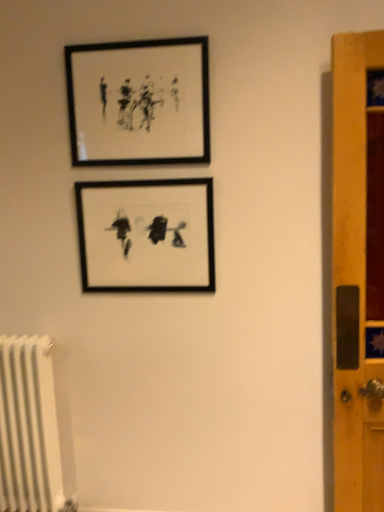
Question: Which is correct: black matte picture frame at upper center, positioned as the first picture frame in top-to-bottom order, is inside black matte picture frame at center, arranged as the 2th picture frame when viewed from the top, or outside of it?

Choices:
 (A) outside
 (B) inside

Answer: (A)

Question: Relative to black matte picture frame at center, arranged as the 2th picture frame when viewed from the top, is black matte picture frame at upper center, which is counted as the 2th picture frame, starting from the bottom, in front or behind?

Choices:
 (A) behind
 (B) front

Answer: (B)

Question: Is black matte picture frame at upper center, which is counted as the 2th picture frame, starting from the bottom, to the left or to the right of black matte picture frame at center, arranged as the 2th picture frame when viewed from the top, in the image?

Choices:
 (A) left
 (B) right

Answer: (A)

Question: Would you say black matte picture frame at center, arranged as the 2th picture frame when viewed from the top, is inside or outside black matte picture frame at upper center, positioned as the first picture frame in top-to-bottom order?

Choices:
 (A) outside
 (B) inside

Answer: (A)

Question: Is black matte picture frame at center, arranged as the 2th picture frame when viewed from the top, in front of or behind black matte picture frame at upper center, positioned as the first picture frame in top-to-bottom order, in the image?

Choices:
 (A) front
 (B) behind

Answer: (B)

Question: Based on their positions, is black matte picture frame at center, marked as the 1th picture frame in a bottom-to-top arrangement, located to the left or right of black matte picture frame at upper center, positioned as the first picture frame in top-to-bottom order?

Choices:
 (A) left
 (B) right

Answer: (B)

Question: From a real-world perspective, relative to black matte picture frame at upper center, positioned as the first picture frame in top-to-bottom order, is black matte picture frame at center, arranged as the 2th picture frame when viewed from the top, vertically above or below?

Choices:
 (A) above
 (B) below

Answer: (B)